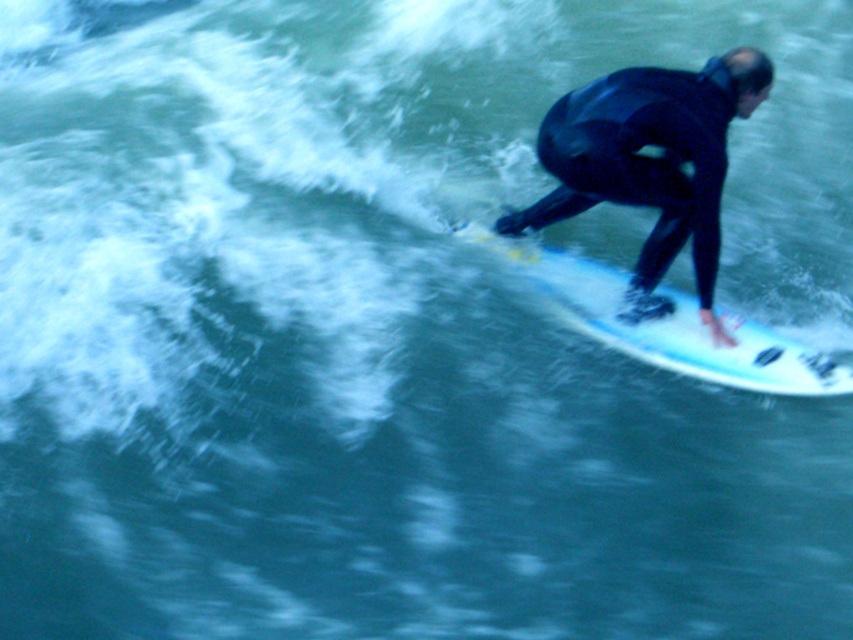
Question: From the image, what is the correct spatial relationship of black matte wetsuit at center in relation to white glossy surfboard at right?

Choices:
 (A) above
 (B) below

Answer: (A)

Question: Which point appears farthest from the camera in this image?

Choices:
 (A) (621, 179)
 (B) (582, 305)

Answer: (B)

Question: Which point is closer to the camera?

Choices:
 (A) white glossy surfboard at right
 (B) black matte wetsuit at center

Answer: (B)

Question: Is black matte wetsuit at center wider than white glossy surfboard at right?

Choices:
 (A) no
 (B) yes

Answer: (A)

Question: Can you confirm if black matte wetsuit at center is bigger than white glossy surfboard at right?

Choices:
 (A) no
 (B) yes

Answer: (A)